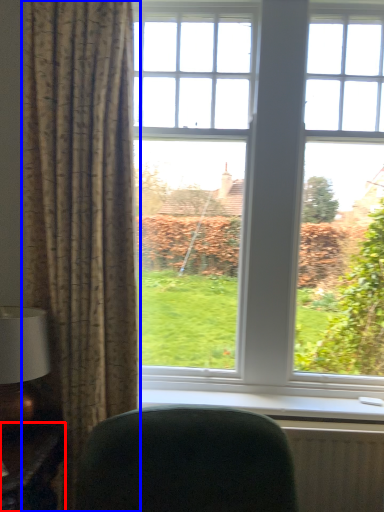
Question: Which object appears farthest to the camera in this image, table (highlighted by a red box) or curtain (highlighted by a blue box)?

Choices:
 (A) table
 (B) curtain

Answer: (B)